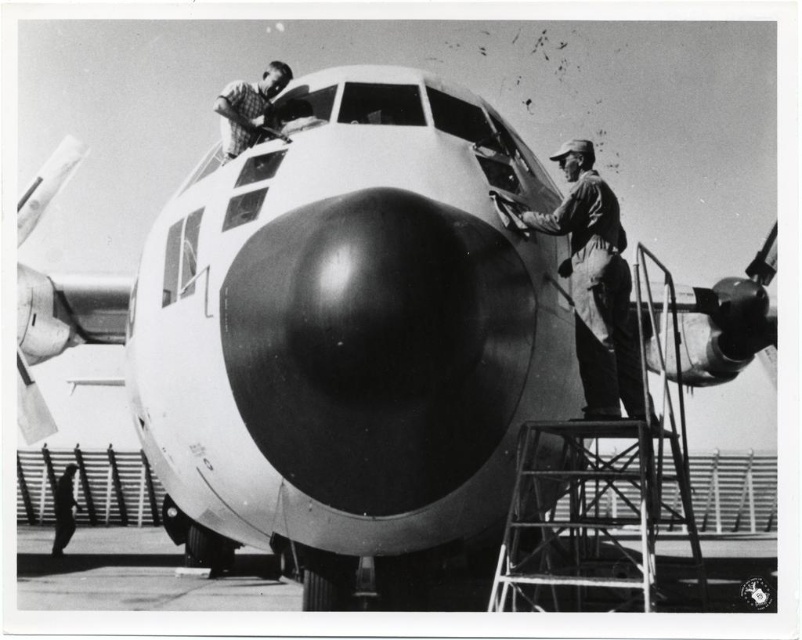
How distant is dark gray uniform at center from brushed metal airplane at upper center?

The distance of dark gray uniform at center from brushed metal airplane at upper center is 9.36 feet.

Between dark gray uniform at center and brushed metal airplane at upper center, which one is positioned lower?

dark gray uniform at center is below.

Does point (618, 211) come in front of point (261, 86)?

That is True.

Identify the location of dark gray uniform at center. Image resolution: width=802 pixels, height=640 pixels. (596, 285).

Find the location of a particular element. brushed metal airplane at upper center is located at coordinates (246, 108).

Does point (265, 80) come behind point (75, 465)?

That is False.

I want to click on brushed metal airplane at upper center, so click(x=246, y=108).

Does dark gray uniform at center come behind dark gray uniform at lower left?

No, dark gray uniform at center is in front of dark gray uniform at lower left.

Where is `dark gray uniform at center`? Image resolution: width=802 pixels, height=640 pixels. dark gray uniform at center is located at coordinates (596, 285).